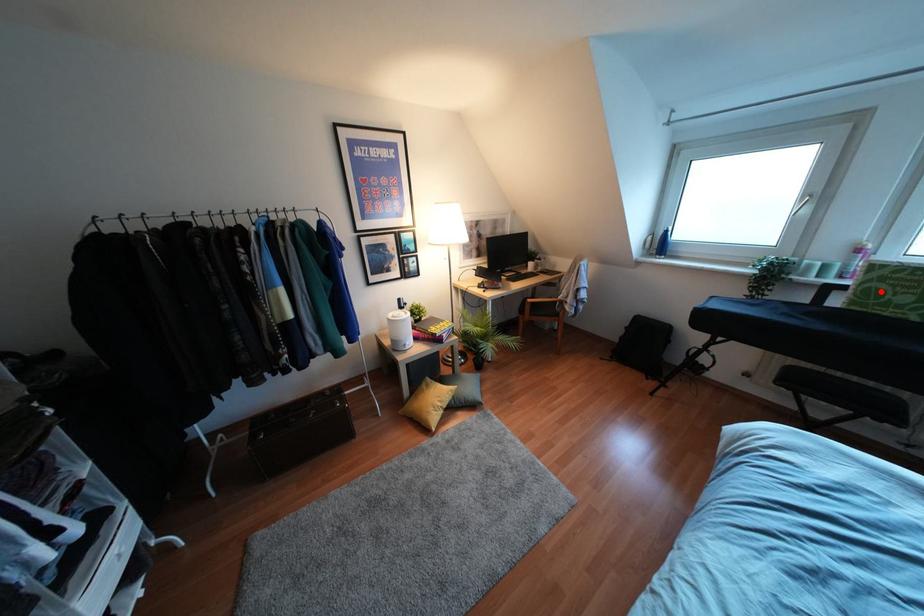
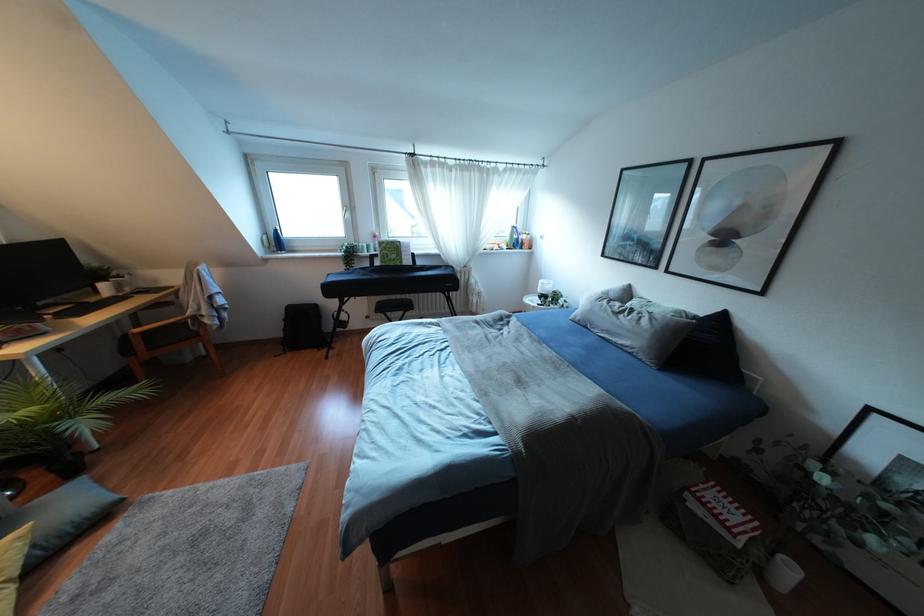
Locate, in the second image, the point that corresponds to the highlighted location in the first image.

(385, 254)